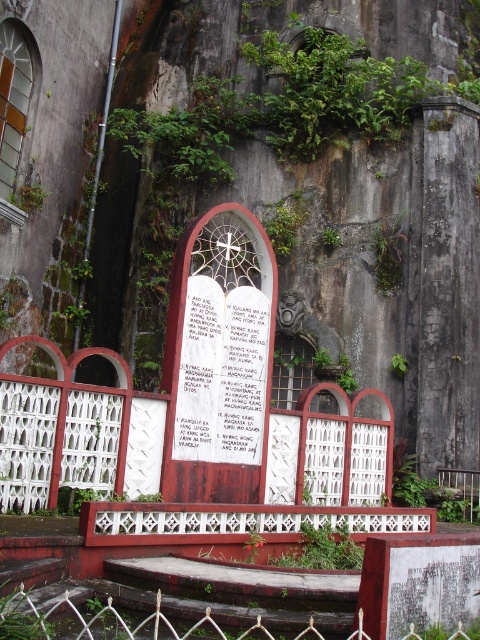
Question: Does white paper at center appear on the left side of white metal fence at lower center?

Choices:
 (A) no
 (B) yes

Answer: (B)

Question: Among these objects, which one is farthest from the camera?

Choices:
 (A) white metal fence at lower center
 (B) white paper at center

Answer: (B)

Question: Which object is farther from the camera taking this photo?

Choices:
 (A) white metal fence at lower center
 (B) white paper at center

Answer: (B)

Question: Is white paper at center wider than white metal fence at lower center?

Choices:
 (A) yes
 (B) no

Answer: (B)

Question: Can you confirm if white paper at center is positioned to the left of white metal fence at lower center?

Choices:
 (A) no
 (B) yes

Answer: (B)